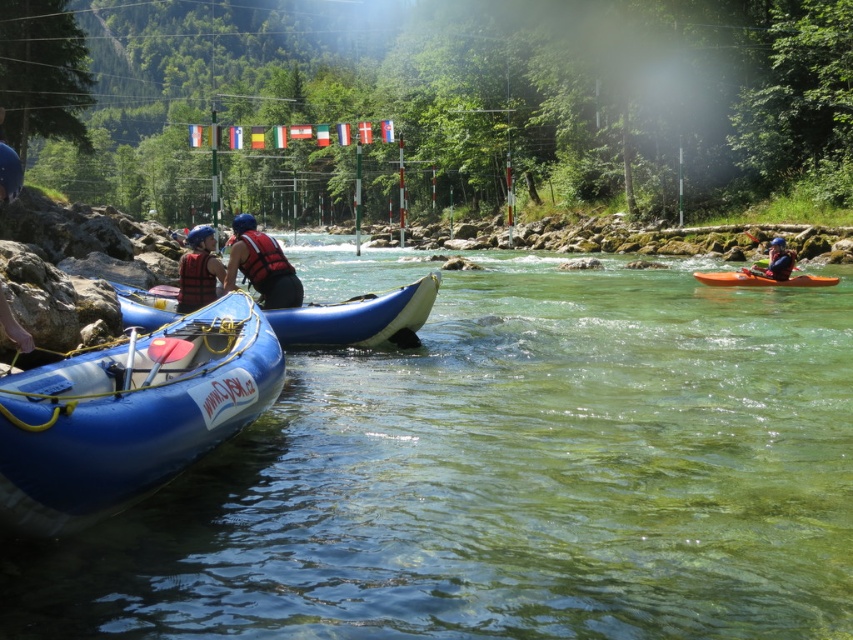
You are a safety inspector checking the setup for a river activity. You need to ensure that the blue rubber raft at left and the matte blue kayak at right are positioned correctly. According to safety guidelines, the raft should be downstream of the kayak. Is the current arrangement compliant with this requirement?

The blue rubber raft at left is below matte blue kayak at right, which means it is positioned downstream. This arrangement complies with the safety guidelines requiring the raft to be downstream of the kayak.

You are planning to board one of the watercrafts shown. The blue rubber raft at left and the matte blue kayak at right are both available. If you want to choose the taller one, which one should you pick?

The matte blue kayak at right is taller than the blue rubber raft at left, so you should choose the matte blue kayak at right.

You are planning to carry both the blue rubber boat at lower left and the matte red life vest at center across a narrow bridge that can only hold one object at a time. Which object should you carry first to ensure the bridge can handle the width of the next object?

The blue rubber boat at lower left has a larger width than the matte red life vest at center. Therefore, you should carry the blue rubber boat at lower left first, as its larger width would require more space, allowing the narrower matte red life vest at center to fit afterward.